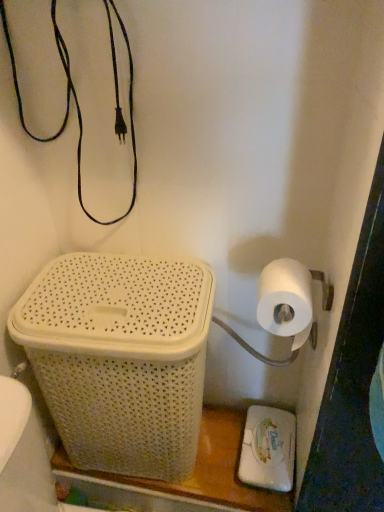
What do you see at coordinates (120, 358) in the screenshot?
I see `white wicker basket at lower left` at bounding box center [120, 358].

Image resolution: width=384 pixels, height=512 pixels. What are the coordinates of `white matte toilet paper at right` in the screenshot? It's located at (286, 300).

Is white matte toilet paper at right facing towards white wicker basket at lower left?

No, white matte toilet paper at right is not facing towards white wicker basket at lower left.

Is white matte toilet paper at right situated inside white wicker basket at lower left or outside?

white matte toilet paper at right is located beyond the bounds of white wicker basket at lower left.

The image size is (384, 512). What are the coordinates of `basket container lying below the white matte toilet paper at right (from the image's perspective)` in the screenshot? It's located at (120, 358).

Can you confirm if white matte toilet paper at right is positioned to the right of white wicker basket at lower left?

Indeed, white matte toilet paper at right is positioned on the right side of white wicker basket at lower left.

Is white wicker basket at lower left touching white wicker basket at lower left?

No, white wicker basket at lower left is not in contact with white wicker basket at lower left.

Which is in front, point (153, 277) or point (143, 492)?

Positioned in front is point (153, 277).

Looking at the image, does white wicker basket at lower left seem bigger or smaller compared to white wicker basket at lower left?

white wicker basket at lower left is smaller than white wicker basket at lower left.

Considering the sizes of objects white wicker basket at lower left and white matte toilet paper at right in the image provided, who is smaller, white wicker basket at lower left or white matte toilet paper at right?

Smaller between the two is white matte toilet paper at right.

Is white wicker basket at lower left located outside white matte toilet paper at right?

Absolutely, white wicker basket at lower left is external to white matte toilet paper at right.

Consider the image. From the image's perspective, is white wicker basket at lower left located beneath white matte toilet paper at right?

Yes, from the image's perspective, white wicker basket at lower left is beneath white matte toilet paper at right.

From a real-world perspective, who is located lower, white wicker basket at lower left or white matte toilet paper at right?

From a 3D spatial view, white wicker basket at lower left is below.

Identify the location of toilet paper that appears in front of the white wicker basket at lower left. The image size is (384, 512). (286, 300).

Based on the photo, between white matte toilet paper at right and white wicker basket at lower left, which one has larger width?

Wider between the two is white wicker basket at lower left.

Is white matte toilet paper at right to the left of white wicker basket at lower left from the viewer's perspective?

No.

Considering the sizes of objects white wicker basket at lower left and white matte toilet paper at right in the image provided, who is shorter, white wicker basket at lower left or white matte toilet paper at right?

white matte toilet paper at right is shorter.

Is white wicker basket at lower left far away from white matte toilet paper at right?

No, there isn't a large distance between white wicker basket at lower left and white matte toilet paper at right.

Where is `toilet paper in front of the white wicker basket at lower left`? toilet paper in front of the white wicker basket at lower left is located at coordinates tap(286, 300).

Would you say white wicker basket at lower left is inside or outside white matte toilet paper at right?

white wicker basket at lower left lies outside white matte toilet paper at right.

Is white wicker basket at lower left wider or thinner than white wicker basket at lower left?

Clearly, white wicker basket at lower left has less width compared to white wicker basket at lower left.

From a real-world perspective, is white wicker basket at lower left physically above white wicker basket at lower left?

Incorrect, from a real-world perspective, white wicker basket at lower left is lower than white wicker basket at lower left.

Which is closer, [230,433] or [65,361]?

The point [65,361] is more forward.

At what (x,y) coordinates should I click in order to perform the action: click on toilet paper located above the white wicker basket at lower left (from the image's perspective). Please return your answer as a coordinate pair (x, y). The image size is (384, 512). Looking at the image, I should click on (286, 300).

What are the coordinates of `basket container in front of the white wicker basket at lower left` in the screenshot? It's located at (120, 358).

Estimate the real-world distances between objects in this image. Which object is closer to white matte toilet paper at right, white wicker basket at lower left or white wicker basket at lower left?

Among the two, white wicker basket at lower left is located nearer to white matte toilet paper at right.

Looking at the image, which one is located closer to white wicker basket at lower left, white matte toilet paper at right or white wicker basket at lower left?

The object closer to white wicker basket at lower left is white wicker basket at lower left.

From the image, which object appears to be nearer to white wicker basket at lower left, white matte toilet paper at right or white wicker basket at lower left?

white wicker basket at lower left is positioned closer to the anchor white wicker basket at lower left.

Which object lies nearer to the anchor point white wicker basket at lower left, white wicker basket at lower left or white matte toilet paper at right?

white wicker basket at lower left lies closer to white wicker basket at lower left than the other object.

Based on the photo, when comparing their distances from white matte toilet paper at right, does white wicker basket at lower left or white wicker basket at lower left seem further?

Among the two, white wicker basket at lower left is located further to white matte toilet paper at right.

From the picture: From the image, which object appears to be nearer to white wicker basket at lower left, white wicker basket at lower left or white matte toilet paper at right?

white wicker basket at lower left.

This screenshot has height=512, width=384. I want to click on basket container between white matte toilet paper at right and white wicker basket at lower left in the up-down direction, so click(x=120, y=358).